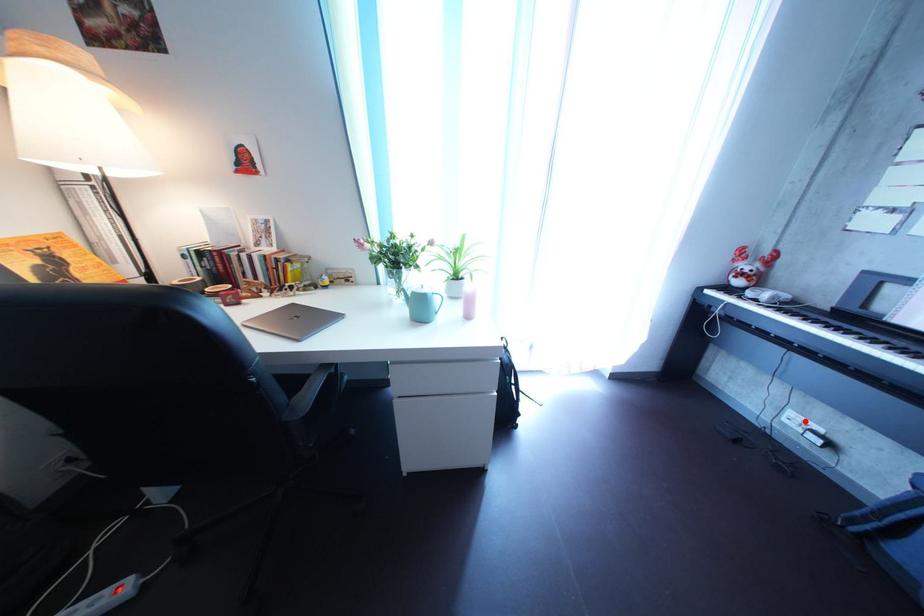
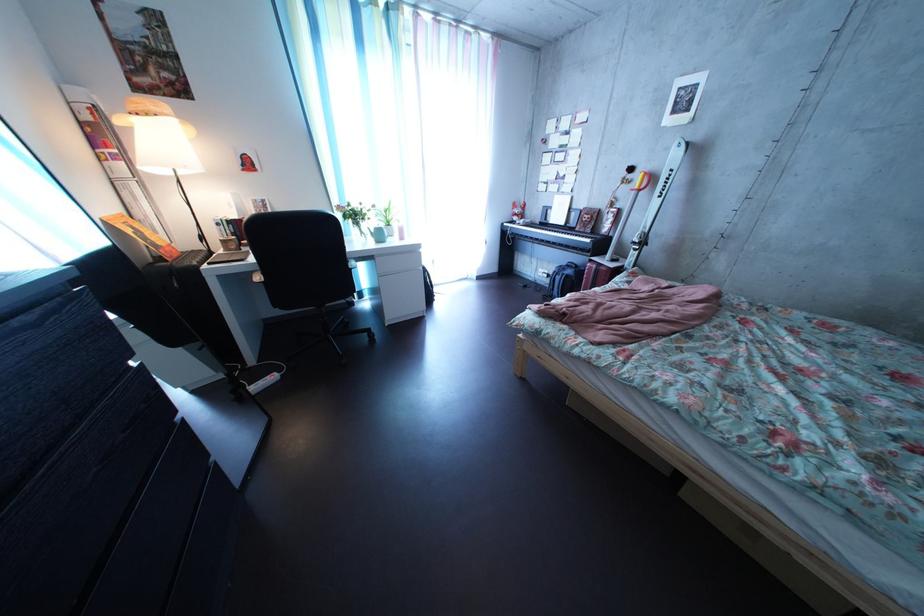
Question: I am providing you with two images of the same scene from different viewpoints. A red point is shown in image1. For the corresponding object point in image2, is it positioned nearer or farther from the camera?

Choices:
 (A) Nearer
 (B) Farther

Answer: (A)